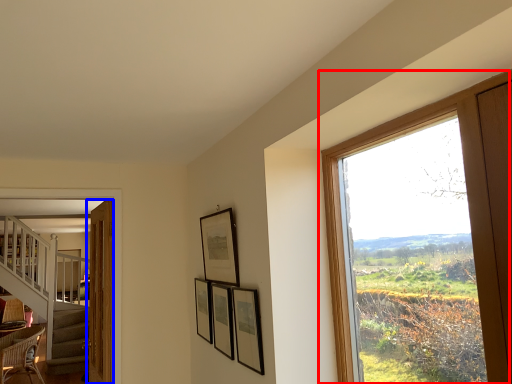
Question: Which object appears closest to the camera in this image, window (highlighted by a red box) or door (highlighted by a blue box)?

Choices:
 (A) window
 (B) door

Answer: (A)